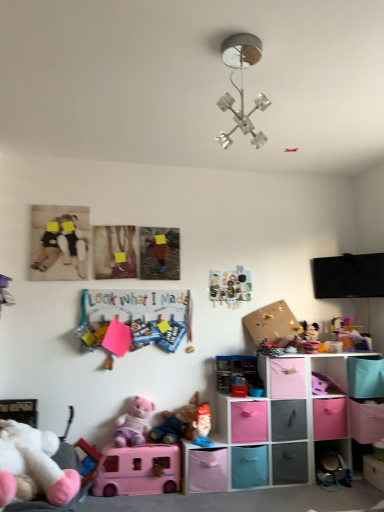
The image size is (384, 512). Identify the location of fabric storage cubes at lower right, which is the fourth shelf from right to left. (276, 425).

Describe the element at coordinates (373, 471) in the screenshot. I see `pink fabric storage cube at lower right, which appears as the seventh shelf when viewed from the left` at that location.

The image size is (384, 512). What do you see at coordinates (242, 117) in the screenshot?
I see `silver metallic light fixture at upper center` at bounding box center [242, 117].

What do you see at coordinates (204, 468) in the screenshot? I see `pink fabric storage bin at lower center, the seventh shelf in the right-to-left sequence` at bounding box center [204, 468].

How much space does pink plush toy at lower center, which appears as the 8th toy when viewed from the right, occupy vertically?

The height of pink plush toy at lower center, which appears as the 8th toy when viewed from the right, is 12.15 inches.

Locate an element on the screen. The height and width of the screenshot is (512, 384). fabric storage cubes at lower right, which is the 4th shelf from left to right is located at coordinates (276, 425).

How many degrees apart are the facing directions of teal fabric storage bin at lower center, arranged as the sixth shelf when viewed from the right, and wooden climbing wall at center right, which is counted as the ninth toy, starting from the left?

The angle between the facing direction of teal fabric storage bin at lower center, arranged as the sixth shelf when viewed from the right, and the facing direction of wooden climbing wall at center right, which is counted as the ninth toy, starting from the left, is 7.38e-05 degrees.

Looking at this image, from the image's perspective, is teal fabric storage bin at lower center, arranged as the sixth shelf when viewed from the right, located beneath wooden climbing wall at center right, which is counted as the ninth toy, starting from the left?

Yes, from the image's perspective, teal fabric storage bin at lower center, arranged as the sixth shelf when viewed from the right, is beneath wooden climbing wall at center right, which is counted as the ninth toy, starting from the left.

Which object is wider, teal fabric storage bin at lower center, the 2th shelf positioned from the left, or wooden climbing wall at center right, the third toy when ordered from right to left?

teal fabric storage bin at lower center, the 2th shelf positioned from the left.

Does point (240, 484) lie in front of point (275, 344)?

Yes, it is in front of point (275, 344).

This screenshot has width=384, height=512. Find the location of `bulletin board that is on the left side of black matte tv at right`. bulletin board that is on the left side of black matte tv at right is located at coordinates (131, 318).

Is cardboard bulletin board at center not inside black matte tv at right?

Absolutely, cardboard bulletin board at center is external to black matte tv at right.

Between point (172, 310) and point (378, 284), which one is positioned in front?

The point (172, 310) is closer.

Is the position of cardboard bulletin board at center more distant than that of black matte tv at right?

No, the depth of cardboard bulletin board at center is less than that of black matte tv at right.

From a real-world perspective, which object rests below the other?

white plush toy at lower left, the 10th toy viewed from the right, from a real-world perspective.

Considering the positions of objects wooden climbing wall at center right, the third toy when ordered from right to left, and white plush toy at lower left, the 10th toy viewed from the right, in the image provided, who is behind, wooden climbing wall at center right, the third toy when ordered from right to left, or white plush toy at lower left, the 10th toy viewed from the right,?

wooden climbing wall at center right, the third toy when ordered from right to left, is more distant.

Which is in front, point (299, 332) or point (23, 470)?

Positioned in front is point (23, 470).

Can you tell me how much wooden climbing wall at center right, which is counted as the ninth toy, starting from the left, and white plush toy at lower left, the second toy positioned from the left, differ in facing direction?

The angle between the facing direction of wooden climbing wall at center right, which is counted as the ninth toy, starting from the left, and the facing direction of white plush toy at lower left, the second toy positioned from the left, is 96.1 degrees.

Is matte plastic toy at center, the seventh toy in the left-to-right sequence, looking in the opposite direction of metallic silver magnets at center, the 8th toy when ordered from left to right?

No, metallic silver magnets at center, the 8th toy when ordered from left to right, is not at the back of matte plastic toy at center, the seventh toy in the left-to-right sequence.

Considering the positions of point (194, 443) and point (210, 285), is point (194, 443) closer or farther from the camera than point (210, 285)?

Clearly, point (194, 443) is closer to the camera than point (210, 285).

Which of these two, matte plastic toy at center, the seventh toy in the left-to-right sequence, or metallic silver magnets at center, the 8th toy when ordered from left to right, is smaller?

With smaller size is metallic silver magnets at center, the 8th toy when ordered from left to right.

From a real-world perspective, is matte plastic toy at center, placed as the 5th toy when sorted from right to left, below metallic silver magnets at center, the fourth toy from the right?

Correct, in the physical world, matte plastic toy at center, placed as the 5th toy when sorted from right to left, is lower than metallic silver magnets at center, the fourth toy from the right.

Is plush fabric toy at lower center, positioned as the sixth toy in left-to-right order, spatially inside matte plastic toy at center, placed as the 5th toy when sorted from right to left, or outside of it?

plush fabric toy at lower center, positioned as the sixth toy in left-to-right order, is not inside matte plastic toy at center, placed as the 5th toy when sorted from right to left, it's outside.

Based on their sizes in the image, would you say plush fabric toy at lower center, positioned as the sixth toy in left-to-right order, is bigger or smaller than matte plastic toy at center, the seventh toy in the left-to-right sequence?

In the image, plush fabric toy at lower center, positioned as the sixth toy in left-to-right order, appears to be larger than matte plastic toy at center, the seventh toy in the left-to-right sequence.

Considering the sizes of plush fabric toy at lower center, the 6th toy when ordered from right to left, and matte plastic toy at center, placed as the 5th toy when sorted from right to left, in the image, is plush fabric toy at lower center, the 6th toy when ordered from right to left, wider or thinner than matte plastic toy at center, placed as the 5th toy when sorted from right to left,?

Clearly, plush fabric toy at lower center, the 6th toy when ordered from right to left, has more width compared to matte plastic toy at center, placed as the 5th toy when sorted from right to left.

How different are the orientations of plush fabric toy at lower center, positioned as the sixth toy in left-to-right order, and matte plastic toy at center, placed as the 5th toy when sorted from right to left, in degrees?

There is a 0.000679-degree angle between the facing directions of plush fabric toy at lower center, positioned as the sixth toy in left-to-right order, and matte plastic toy at center, placed as the 5th toy when sorted from right to left.

Which is in front, teal fabric storage bin at lower center, the 2th shelf positioned from the left, or matte plastic toy at center, the seventh toy in the left-to-right sequence?

teal fabric storage bin at lower center, the 2th shelf positioned from the left, is more forward.

Considering the sizes of objects teal fabric storage bin at lower center, the 2th shelf positioned from the left, and matte plastic toy at center, the seventh toy in the left-to-right sequence, in the image provided, who is shorter, teal fabric storage bin at lower center, the 2th shelf positioned from the left, or matte plastic toy at center, the seventh toy in the left-to-right sequence,?

Standing shorter between the two is matte plastic toy at center, the seventh toy in the left-to-right sequence.

How many degrees apart are the facing directions of teal fabric storage bin at lower center, arranged as the sixth shelf when viewed from the right, and matte plastic toy at center, the seventh toy in the left-to-right sequence?

0.53 degrees separate the facing orientations of teal fabric storage bin at lower center, arranged as the sixth shelf when viewed from the right, and matte plastic toy at center, the seventh toy in the left-to-right sequence.

Which toy is the 2nd one when counting from the left side of the teal fabric storage bin at lower center, the 2th shelf positioned from the left? Please provide its 2D coordinates.

[(202, 426)]

Is wooden climbing wall at center right, which is counted as the ninth toy, starting from the left, thinner than pink plastic bus at lower center, which is the 7th toy from right to left?

Indeed, wooden climbing wall at center right, which is counted as the ninth toy, starting from the left, has a lesser width compared to pink plastic bus at lower center, which is the 7th toy from right to left.

From the image's perspective, which one is positioned lower, wooden climbing wall at center right, which is counted as the ninth toy, starting from the left, or pink plastic bus at lower center, which is the 7th toy from right to left?

pink plastic bus at lower center, which is the 7th toy from right to left, appears lower in the image.

Do you think wooden climbing wall at center right, which is counted as the ninth toy, starting from the left, is within pink plastic bus at lower center, the fifth toy when ordered from left to right, or outside of it?

wooden climbing wall at center right, which is counted as the ninth toy, starting from the left, is outside pink plastic bus at lower center, the fifth toy when ordered from left to right.

Is wooden climbing wall at center right, which is counted as the ninth toy, starting from the left, touching pink plastic bus at lower center, the fifth toy when ordered from left to right?

No, wooden climbing wall at center right, which is counted as the ninth toy, starting from the left, is not with pink plastic bus at lower center, the fifth toy when ordered from left to right.

Image resolution: width=384 pixels, height=512 pixels. I want to click on the 2nd shelf counting from the left side of the wooden climbing wall at center right, which is counted as the ninth toy, starting from the left, so click(249, 466).

Identify the location of window screen that appears behind the cardboard bulletin board at center. (348, 276).

When comparing their distances from pink matte paper at center, the 3th toy positioned from the left, does white plush toy at lower left, the second toy positioned from the left, or cardboard bulletin board at center seem closer?

Answer: cardboard bulletin board at center is positioned closer to the anchor pink matte paper at center, the 3th toy positioned from the left.

Considering their positions, is transparent plastic shelf at lower right, the 6th shelf positioned from the left, positioned further to matte plastic toy at center, placed as the 5th toy when sorted from right to left, than plush fabric toy at lower center, positioned as the sixth toy in left-to-right order?

Among the two, transparent plastic shelf at lower right, the 6th shelf positioned from the left, is located further to matte plastic toy at center, placed as the 5th toy when sorted from right to left.

Which object lies further to the anchor point pink fabric storage bin at lower center, arranged as the 5th shelf when viewed from the right, pink plastic bus at lower center, which is the 7th toy from right to left, or pink fabric storage cube at lower right, which appears as the seventh shelf when viewed from the left?

pink fabric storage cube at lower right, which appears as the seventh shelf when viewed from the left, is positioned further to the anchor pink fabric storage bin at lower center, arranged as the 5th shelf when viewed from the right.

From the image, which object appears to be nearer to pink plastic bus at lower center, which is the 7th toy from right to left, pink fabric storage cube at lower right, which is counted as the 1th shelf, starting from the right, or transparent plastic shelf at lower right, which is the second shelf in right-to-left order?

transparent plastic shelf at lower right, which is the second shelf in right-to-left order, is closer to pink plastic bus at lower center, which is the 7th toy from right to left.

From the image, which object appears to be farther from pink plastic bus at lower center, the fifth toy when ordered from left to right, matte plastic toy at center, the seventh toy in the left-to-right sequence, or pink fabric storage bin at lower center, the seventh shelf in the right-to-left sequence?

Among the two, matte plastic toy at center, the seventh toy in the left-to-right sequence, is located further to pink plastic bus at lower center, the fifth toy when ordered from left to right.

Based on their spatial positions, is metallic silver magnets at center, the fourth toy from the right, or pink plastic bus at lower center, the fifth toy when ordered from left to right, further from matte plastic toy at center, the seventh toy in the left-to-right sequence?

metallic silver magnets at center, the fourth toy from the right, is positioned further to the anchor matte plastic toy at center, the seventh toy in the left-to-right sequence.

Consider the image. Based on their spatial positions, is pink fabric storage bin at lower center, the seventh shelf in the right-to-left sequence, or black matte teddy bear at left, which is counted as the eleventh toy, starting from the right, closer to pink matte paper at center, the 3th toy positioned from the left?

black matte teddy bear at left, which is counted as the eleventh toy, starting from the right, is positioned closer to the anchor pink matte paper at center, the 3th toy positioned from the left.

Based on their spatial positions, is translucent plastic toy at right, which is the 11th toy from left to right, or matte pink plush at lower right, the 2th toy viewed from the right, closer to pink fabric storage cube at lower right, which appears as the seventh shelf when viewed from the left?

translucent plastic toy at right, which is the 11th toy from left to right.

This screenshot has width=384, height=512. Find the location of `window screen between pink matte paper at center, the 9th toy from the right, and translucent plastic toy at right, which is the 11th toy from left to right`. window screen between pink matte paper at center, the 9th toy from the right, and translucent plastic toy at right, which is the 11th toy from left to right is located at coordinates (348, 276).

I want to click on cabinet between silver metallic light fixture at upper center and transparent plastic shelf at lower right, the 6th shelf positioned from the left, in the vertical direction, so click(x=332, y=368).

Where is `bulletin board between pink matte paper at center, the 9th toy from the right, and wooden climbing wall at center right, the third toy when ordered from right to left, from left to right`? bulletin board between pink matte paper at center, the 9th toy from the right, and wooden climbing wall at center right, the third toy when ordered from right to left, from left to right is located at coordinates (131, 318).

Image resolution: width=384 pixels, height=512 pixels. I want to click on window screen between cardboard bulletin board at center and translucent plastic toy at right, placed as the first toy when sorted from right to left, so click(x=348, y=276).